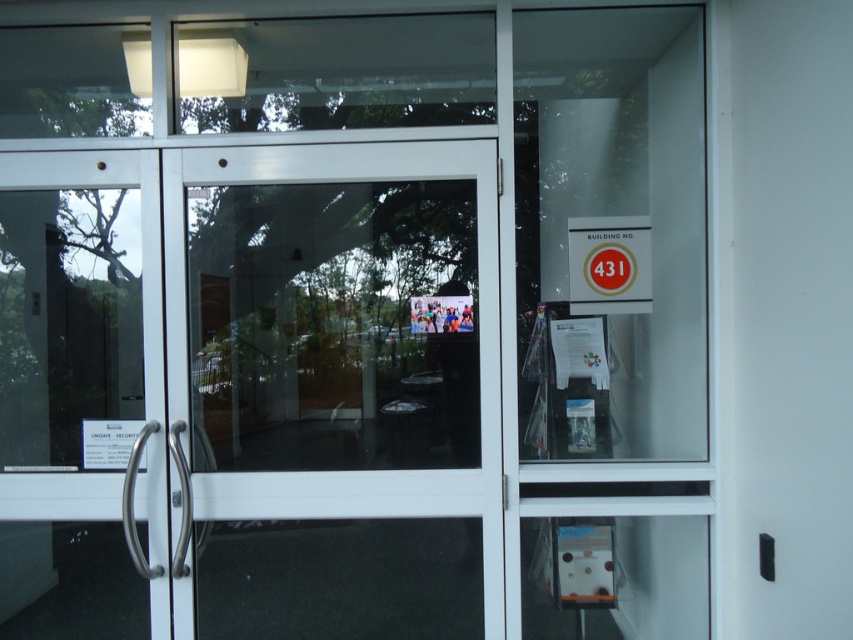
You are a delivery person approaching the transparent glass door at center and the matte gold sign at upper right. Which object would you need to look up higher to see?

The transparent glass door at center is taller than the matte gold sign at upper right, so you would need to look up higher to see the transparent glass door at center.

You are standing in front of the building entrance. To avoid walking into the transparent glass door at center, where should you position yourself relative to the door?

Since the transparent glass door at center is located at coordinates approximately 0.606 on the x and 0.397 on the y axis, you should position yourself to the side of the door to avoid walking into it.

You are standing in front of the entrance and want to read the matte gold sign at upper right. Is it possible to read it without touching the transparent glass door at center?

The transparent glass door at center is below the matte gold sign at upper right, so you can read the matte gold sign at upper right without touching the transparent glass door at center by looking upwards.